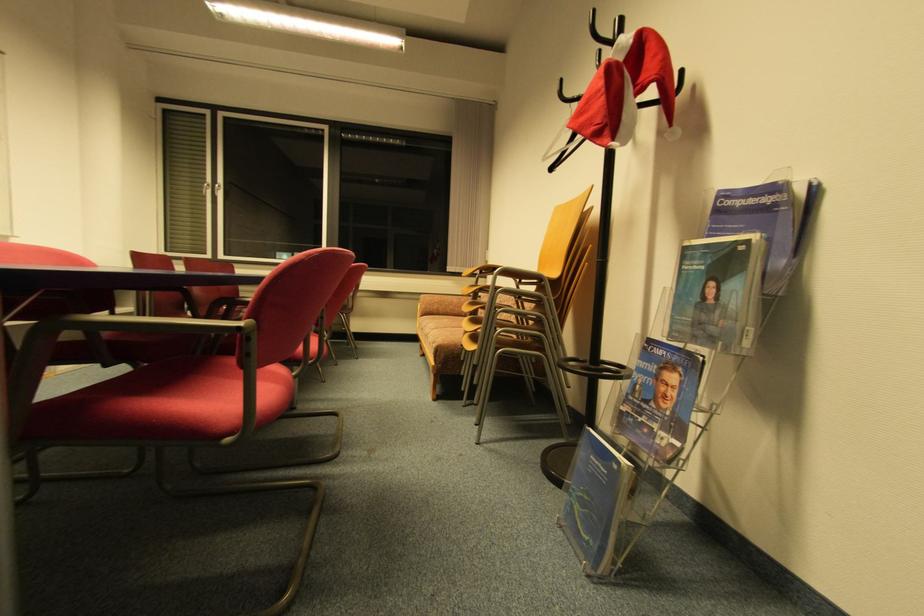
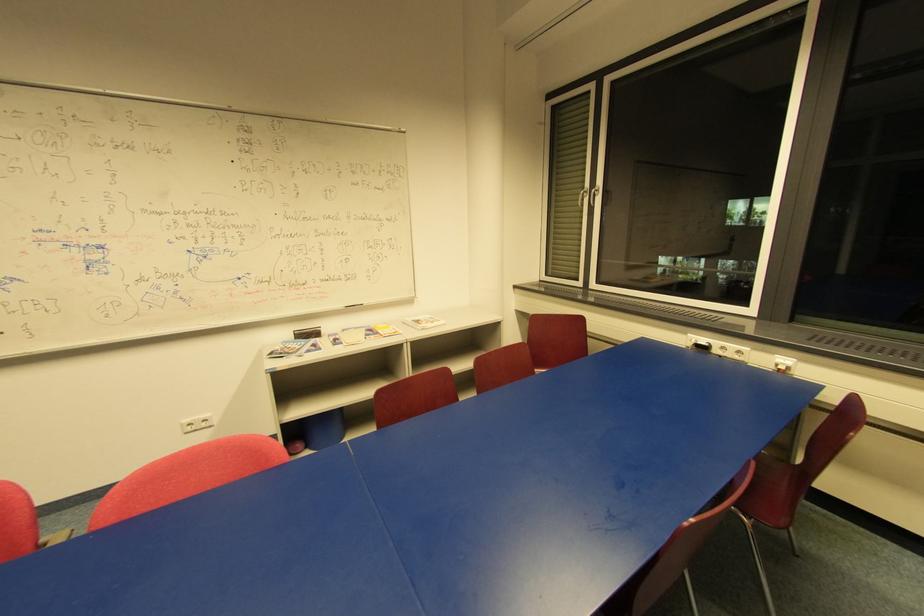
Where in the second image is the point corresponding to [223,187] from the first image?

(598, 192)